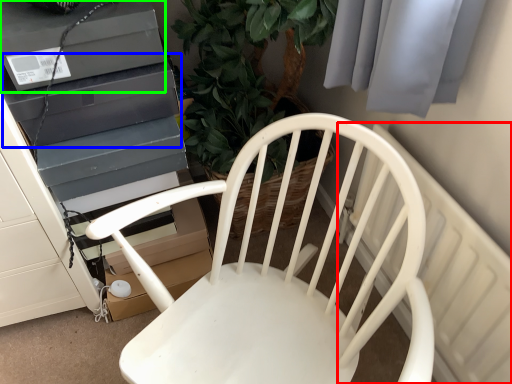
Question: Which is farther away from radiator (highlighted by a red box)? appliance (highlighted by a blue box) or appliance (highlighted by a green box)?

Choices:
 (A) appliance
 (B) appliance

Answer: (B)